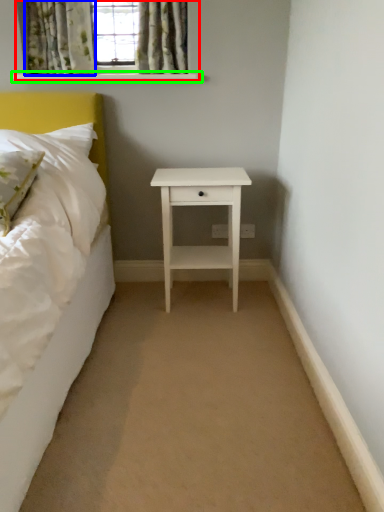
Question: Which object is the closest to the window (highlighted by a red box)? Choose among these: curtain (highlighted by a blue box) or window sill (highlighted by a green box).

Choices:
 (A) curtain
 (B) window sill

Answer: (A)